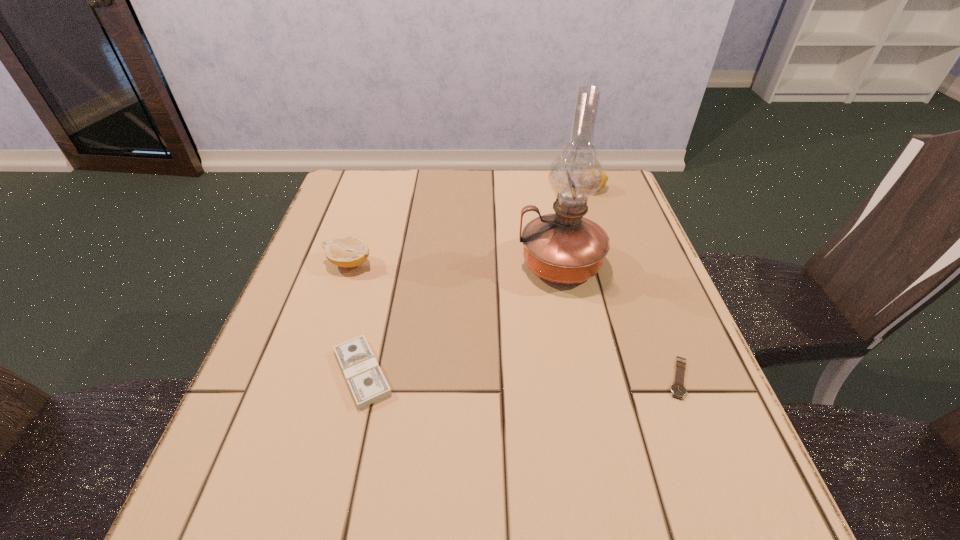
Find the location of a particular element. vacant space located at the stem end of the farther lemon is located at coordinates (517, 189).

Image resolution: width=960 pixels, height=540 pixels. What are the coordinates of `free region located 0.110m on the right of the third tallest object` in the screenshot? It's located at (420, 263).

Where is `free region located on the left of the dollar`? free region located on the left of the dollar is located at coordinates (280, 372).

Image resolution: width=960 pixels, height=540 pixels. In order to click on vacant space located on the left of the watch in this screenshot , I will do `click(457, 377)`.

The height and width of the screenshot is (540, 960). I want to click on object present at the far edge, so click(x=605, y=179).

Locate an element on the screen. The image size is (960, 540). lemon present at the left edge is located at coordinates (347, 251).

This screenshot has width=960, height=540. Identify the location of dollar located in the left edge section of the desktop. (368, 385).

Find the location of a particular element. This screenshot has height=540, width=960. oil lamp located at the right edge is located at coordinates (563, 247).

This screenshot has width=960, height=540. In order to click on lemon situated at the right edge in this screenshot , I will do `click(605, 179)`.

Identify the location of watch that is at the right edge. (678, 390).